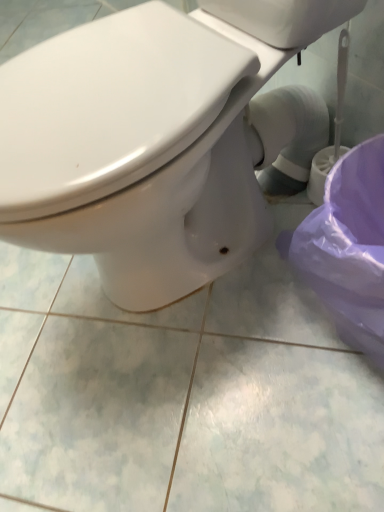
In order to face white glossy toilet at center, should I rotate leftwards or rightwards?

Turn left approximately 3.547 degrees to face it.

Describe the element at coordinates (148, 140) in the screenshot. I see `white glossy toilet at center` at that location.

Find the location of `white glossy toilet at center`. white glossy toilet at center is located at coordinates (148, 140).

This screenshot has width=384, height=512. What do you see at coordinates (349, 247) in the screenshot? I see `purple plastic potty at lower right` at bounding box center [349, 247].

What is the approximate width of purple plastic potty at lower right?

It is 29.08 centimeters.

Measure the distance between point (342, 162) and camera.

Point (342, 162) is 26.06 inches away from camera.

At what (x,y) coordinates should I click in order to perform the action: click on purple plastic potty at lower right. Please return your answer as a coordinate pair (x, y). The height and width of the screenshot is (512, 384). Looking at the image, I should click on (349, 247).

Locate an element on the screen. This screenshot has width=384, height=512. white glossy toilet at center is located at coordinates (148, 140).

Would you say white glossy toilet at center is to the left or to the right of purple plastic potty at lower right in the picture?

From the image, it's evident that white glossy toilet at center is to the left of purple plastic potty at lower right.

Is the depth of white glossy toilet at center less than that of purple plastic potty at lower right?

That is True.

Which is in front, point (261, 158) or point (347, 312)?

The point (347, 312) is closer to the camera.

From the image's perspective, between white glossy toilet at center and purple plastic potty at lower right, which one is located above?

white glossy toilet at center appears higher in the image.

From a real-world perspective, relative to purple plastic potty at lower right, is white glossy toilet at center vertically above or below?

Clearly, from a real-world perspective, white glossy toilet at center is above purple plastic potty at lower right.

Can you confirm if white glossy toilet at center is wider than purple plastic potty at lower right?

Correct, the width of white glossy toilet at center exceeds that of purple plastic potty at lower right.

Is white glossy toilet at center taller or shorter than purple plastic potty at lower right?

In the image, white glossy toilet at center appears to be taller than purple plastic potty at lower right.

Looking at the image, does white glossy toilet at center seem bigger or smaller compared to purple plastic potty at lower right?

Considering their sizes, white glossy toilet at center takes up more space than purple plastic potty at lower right.

Would you say white glossy toilet at center is inside or outside purple plastic potty at lower right?

The correct answer is: outside.

Is white glossy toilet at center far from purple plastic potty at lower right?

No.

Is white glossy toilet at center facing away from purple plastic potty at lower right?

No, white glossy toilet at center is not facing the opposite direction of purple plastic potty at lower right.

How different are the orientations of white glossy toilet at center and purple plastic potty at lower right in degrees?

The facing directions of white glossy toilet at center and purple plastic potty at lower right are 0.00044 degrees apart.

This screenshot has height=512, width=384. There is a purple plastic potty at lower right. Find the location of `toilet above it (from a real-world perspective)`. toilet above it (from a real-world perspective) is located at coordinates (148, 140).

Is purple plastic potty at lower right to the right of white glossy toilet at center from the viewer's perspective?

Indeed, purple plastic potty at lower right is positioned on the right side of white glossy toilet at center.

Does purple plastic potty at lower right lie in front of white glossy toilet at center?

That is False.

Is point (382, 231) farther from viewer compared to point (223, 41)?

Yes, it is behind point (223, 41).

From the image's perspective, which is above, purple plastic potty at lower right or white glossy toilet at center?

white glossy toilet at center, from the image's perspective.

Based on the photo, from a real-world perspective, between purple plastic potty at lower right and white glossy toilet at center, who is vertically lower?

purple plastic potty at lower right is physically lower.

Which of these two, purple plastic potty at lower right or white glossy toilet at center, is wider?

Wider between the two is white glossy toilet at center.

Is purple plastic potty at lower right taller than white glossy toilet at center?

No.

Between purple plastic potty at lower right and white glossy toilet at center, which one has larger size?

Bigger between the two is white glossy toilet at center.

Would you say purple plastic potty at lower right is outside white glossy toilet at center?

Yes, purple plastic potty at lower right is outside of white glossy toilet at center.

Is purple plastic potty at lower right far away from white glossy toilet at center?

No, there isn't a large distance between purple plastic potty at lower right and white glossy toilet at center.

Is purple plastic potty at lower right facing towards white glossy toilet at center?

No, purple plastic potty at lower right is not turned towards white glossy toilet at center.

How different are the orientations of purple plastic potty at lower right and white glossy toilet at center in degrees?

0.00044 degrees separate the facing orientations of purple plastic potty at lower right and white glossy toilet at center.

Locate an element on the screen. potty behind the white glossy toilet at center is located at coordinates (349, 247).

The width and height of the screenshot is (384, 512). In order to click on toilet to the left of purple plastic potty at lower right in this screenshot , I will do `click(148, 140)`.

Image resolution: width=384 pixels, height=512 pixels. I want to click on toilet above the purple plastic potty at lower right (from a real-world perspective), so click(x=148, y=140).